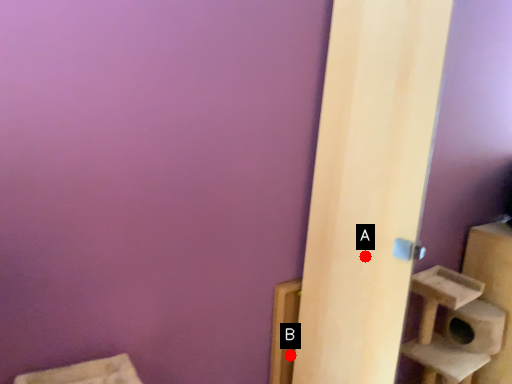
Question: Two points are circled on the image, labeled by A and B beside each circle. Which point is closer to the camera?

Choices:
 (A) A is closer
 (B) B is closer

Answer: (A)